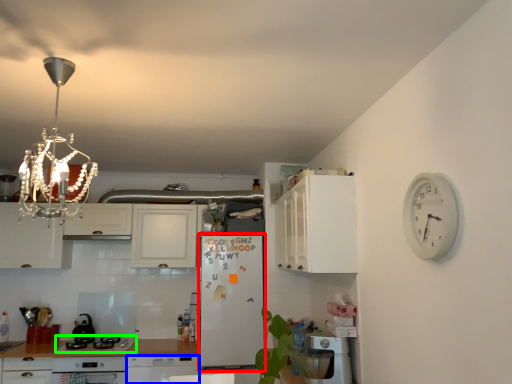
Question: Which object is the closest to the fridge (highlighted by a red box)? Choose among these: dish washer (highlighted by a blue box) or kitchen appliance (highlighted by a green box).

Choices:
 (A) dish washer
 (B) kitchen appliance

Answer: (A)